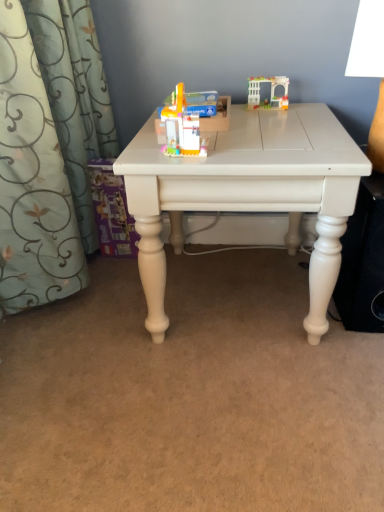
Locate an element on the screen. vacant location below white matte table at center (from a real-world perspective) is located at coordinates (235, 291).